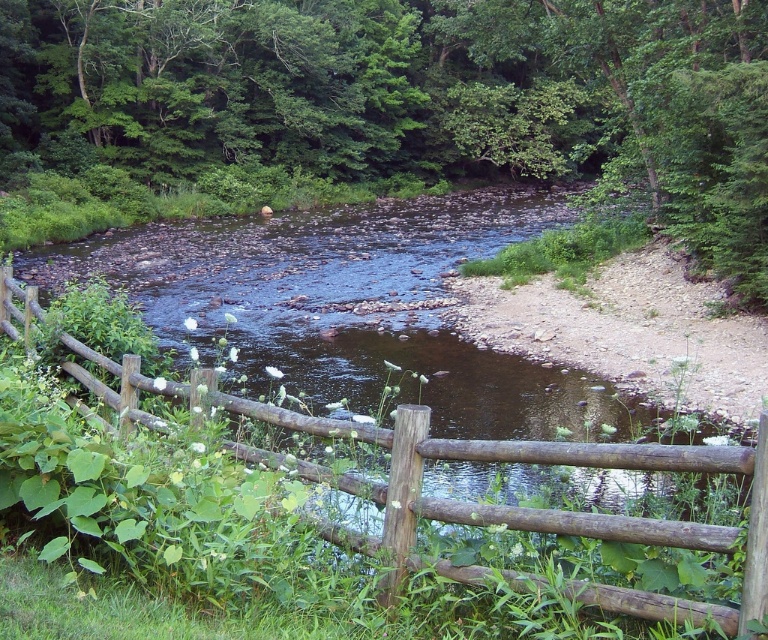
Question: Does green leafy tree at center appear on the left side of brown wooden fence at center?

Choices:
 (A) no
 (B) yes

Answer: (A)

Question: Where is green leafy tree at center located in relation to brown wooden fence at center in the image?

Choices:
 (A) right
 (B) left

Answer: (A)

Question: Where is green leafy tree at center located in relation to brown wooden fence at center in the image?

Choices:
 (A) left
 (B) right

Answer: (B)